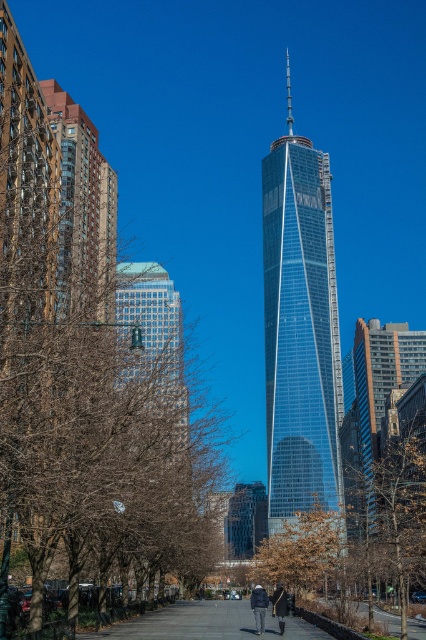
Question: Considering the real-world distances, which object is closest to the brown leafy tree at center?

Choices:
 (A) brown leafless tree at left
 (B) dark gray coat at center
 (C) denim jacket at lower center

Answer: (B)

Question: From the image, what is the correct spatial relationship of glassy steel skyscraper at center in relation to gray concrete pavement at center?

Choices:
 (A) left
 (B) right

Answer: (B)

Question: In this image, where is brown leafy tree at center located relative to clear glass skyscraper at center?

Choices:
 (A) below
 (B) above

Answer: (A)

Question: Does denim jacket at lower center have a larger size compared to dark gray coat at center?

Choices:
 (A) yes
 (B) no

Answer: (B)

Question: Estimate the real-world distances between objects in this image. Which object is closer to the clear glass skyscraper at center?

Choices:
 (A) dark gray coat at center
 (B) brown leafless tree at left
 (C) gray concrete pavement at center
 (D) glassy steel skyscraper at center

Answer: (B)

Question: Estimate the real-world distances between objects in this image. Which object is closer to the glassy steel skyscraper at center?

Choices:
 (A) brown leafy tree at center
 (B) transparent glass skyscraper at center
 (C) brown leafless tree at left
 (D) dark gray coat at center

Answer: (B)